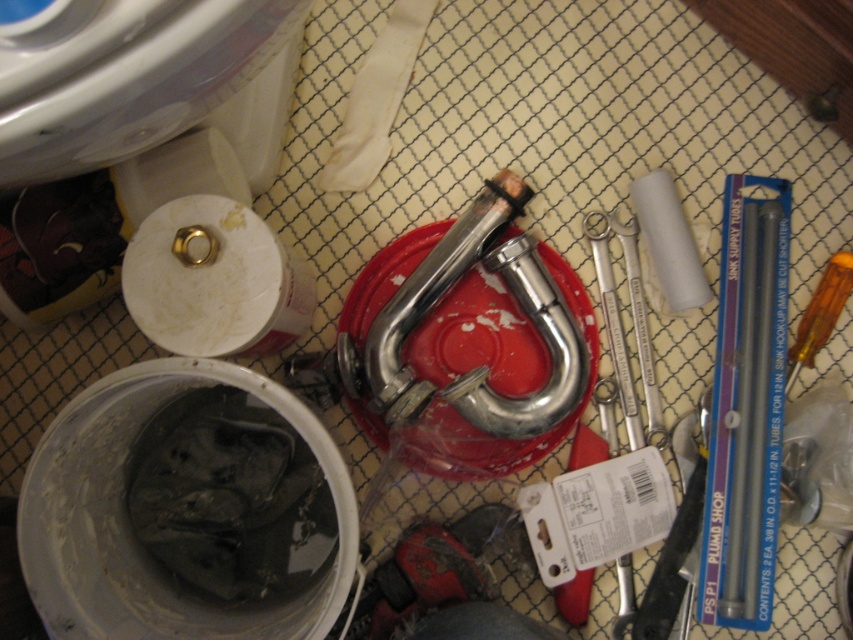
You are a technician trying to organize your workspace. You need to place a new tool between the polished silver tube at right and the orange plastic screwdriver at right. Is there enough space to fit the new tool between them?

The polished silver tube at right is positioned on the left side of orange plastic screwdriver at right, so there is space between them to place the new tool.

You are standing in front of the workspace and want to pick up an object. If you look at the two points marked as point (613,288) and point (837,268), which one is closer to you?

Point (613,288) is closer to the viewer than point (837,268).

You are an engineer inspecting the workspace. You need to locate the polished silver tube at right. According to the coordinates provided, where exactly is it positioned?

The polished silver tube at right is located at point (750, 401).